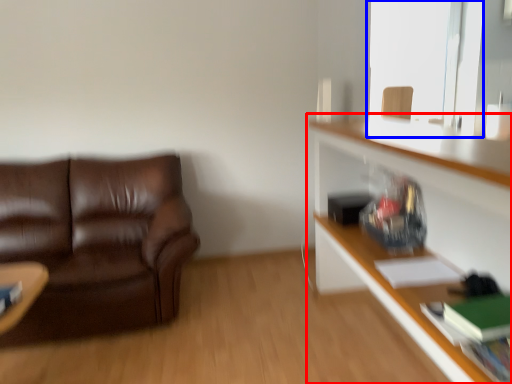
Question: Which of the following is the farthest to the observer, shelf (highlighted by a red box) or window screen (highlighted by a blue box)?

Choices:
 (A) shelf
 (B) window screen

Answer: (B)